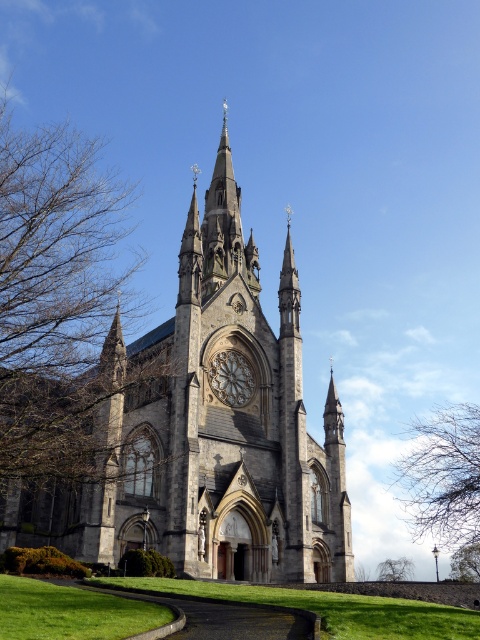
Question: Which of the following is the closest to the observer?

Choices:
 (A) (423, 467)
 (B) (251, 376)

Answer: (B)

Question: Among these points, which one is farthest from the camera?

Choices:
 (A) (384, 564)
 (B) (444, 456)
 (C) (478, 557)

Answer: (A)

Question: Does bare branches at upper center appear on the right side of green leafy tree at lower right?

Choices:
 (A) no
 (B) yes

Answer: (A)

Question: Does gray stone church at center appear on the left side of brown leafless branches at left?

Choices:
 (A) no
 (B) yes

Answer: (A)

Question: Does golden stained glass window at center lie in front of green leafy tree at lower center?

Choices:
 (A) yes
 (B) no

Answer: (A)

Question: Which object is closer to the camera taking this photo?

Choices:
 (A) brown leafless branches at left
 (B) green leafy tree at lower center

Answer: (A)